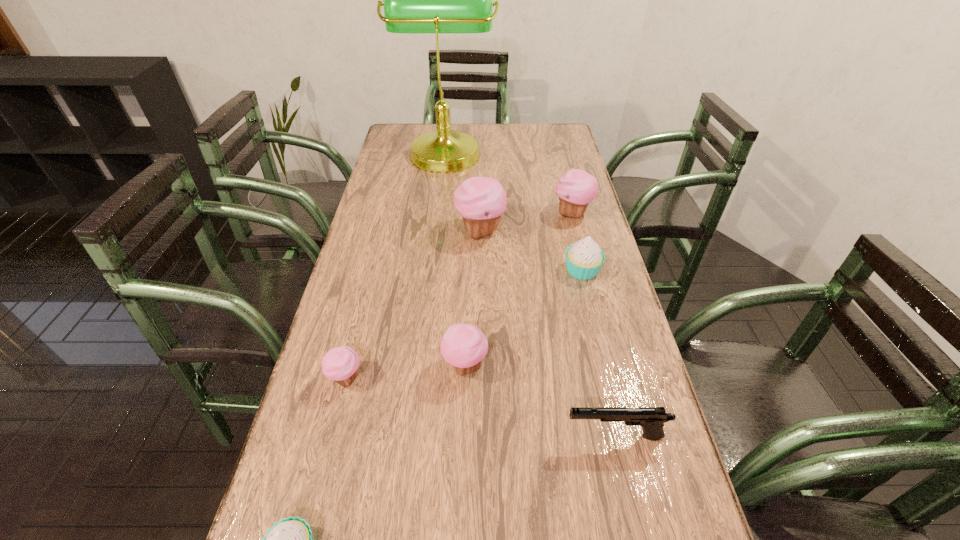
This screenshot has height=540, width=960. I want to click on black gun, so click(652, 419).

Locate an element on the screen. The height and width of the screenshot is (540, 960). the smallest pink cupcake is located at coordinates (340, 364).

Image resolution: width=960 pixels, height=540 pixels. I want to click on vacant space located on the desk next to the farthest object, so click(x=546, y=150).

Identify the location of blank space located on the back of the tallest cupcake. This screenshot has height=540, width=960. (480, 187).

Locate an element on the screen. free space located on the front of the rightmost pink cupcake is located at coordinates click(595, 305).

At what (x,y) coordinates should I click in order to perform the action: click on vacant space located 0.310m on the left of the farther white cupcake. Please return your answer as a coordinate pair (x, y). Looking at the image, I should click on (454, 270).

I want to click on vacant space located on the back of the third biggest pink cupcake, so click(x=468, y=256).

You are a GUI agent. You are given a task and a screenshot of the screen. Output one action in this format:
    pyautogui.click(x=<x>, y=<y>)
    Task: Click on the vacant space located at the aiming end of the second nearest object
    This screenshot has width=960, height=540.
    Given the screenshot: What is the action you would take?
    pyautogui.click(x=467, y=436)

Find the location of `free space located at the aiming end of the second nearest object`. free space located at the aiming end of the second nearest object is located at coordinates (492, 436).

The image size is (960, 540). What are the coordinates of `vacant space situated 0.220m at the aiming end of the second nearest object` in the screenshot? It's located at (457, 436).